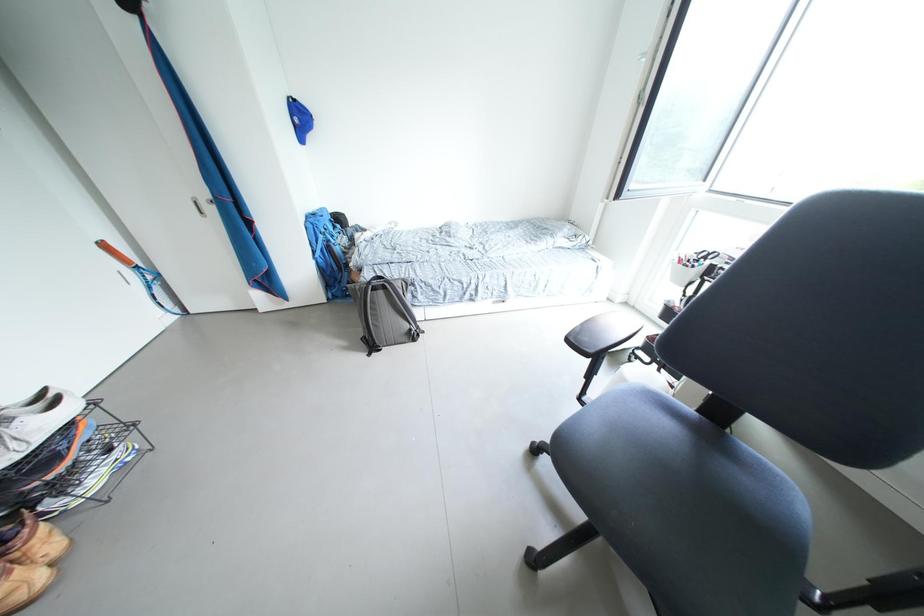
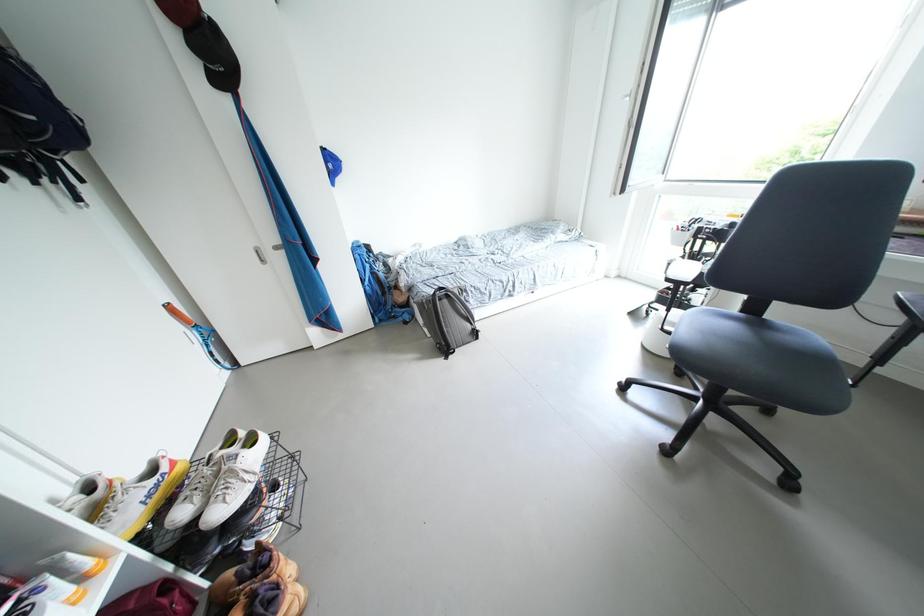
Question: Based on the continuous images, in which direction is the camera rotating? Reply with the corresponding letter.

Choices:
 (A) Left
 (B) Right
 (C) Up
 (D) Down

Answer: (B)